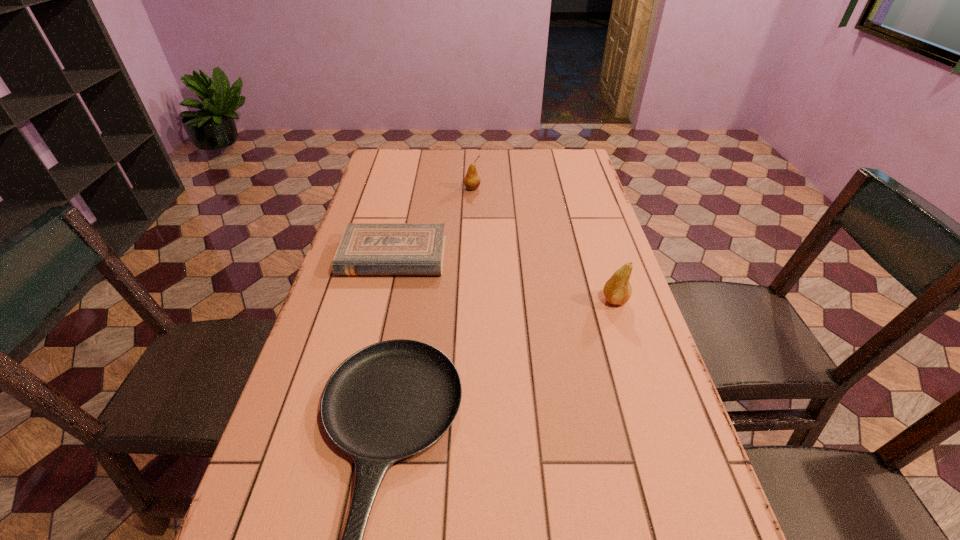
Locate an element on the screen. The height and width of the screenshot is (540, 960). object located at the right edge is located at coordinates (617, 290).

The image size is (960, 540). What are the coordinates of `vacant space at the far edge of the desktop` in the screenshot? It's located at (475, 151).

What are the coordinates of `vacant point at the left edge` in the screenshot? It's located at pos(291,483).

At what (x,y) coordinates should I click in order to perform the action: click on free space at the right edge of the desktop. Please return your answer as a coordinate pair (x, y). The image size is (960, 540). Looking at the image, I should click on (684, 531).

At what (x,y) coordinates should I click in order to perform the action: click on free space at the far left corner of the desktop. Please return your answer as a coordinate pair (x, y). Image resolution: width=960 pixels, height=540 pixels. Looking at the image, I should click on (374, 164).

This screenshot has width=960, height=540. Find the location of `free area in between the nearer pear and the second shortest object`. free area in between the nearer pear and the second shortest object is located at coordinates (504, 278).

At what (x,y) coordinates should I click in order to perform the action: click on blank region between the rightmost object and the left pear. Please return your answer as a coordinate pair (x, y). Image resolution: width=960 pixels, height=540 pixels. Looking at the image, I should click on (543, 245).

This screenshot has width=960, height=540. I want to click on free space between the Bible and the rightmost object, so click(x=504, y=278).

Where is `free point between the third nearest object and the right pear`? free point between the third nearest object and the right pear is located at coordinates (504, 278).

Choose which object is the third nearest neighbor to the second nearest object. Please provide its 2D coordinates. Your answer should be formatted as a tuple, i.e. [(x, y)], where the tuple contains the x and y coordinates of a point satisfying the conditions above.

[(472, 181)]